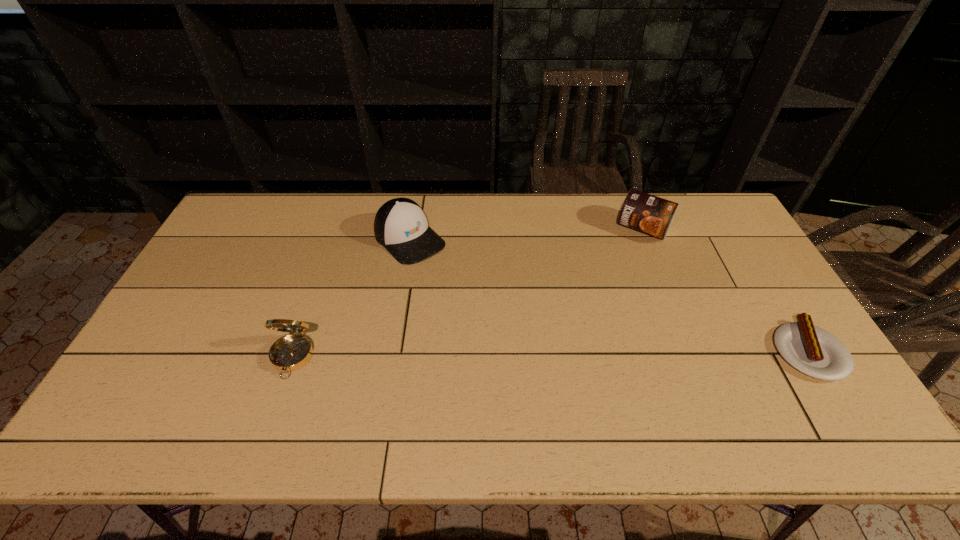
Locate an element on the screen. This screenshot has width=960, height=540. empty location between the can and the cap is located at coordinates (526, 234).

Locate an element on the screen. free space between the can and the cap is located at coordinates (526, 234).

I want to click on free space between the leftmost object and the rightmost object, so click(x=550, y=354).

Locate an element on the screen. This screenshot has width=960, height=540. vacant area between the compass and the shortest object is located at coordinates (550, 354).

Locate an element on the screen. object that is the second nearest to the can is located at coordinates (400, 226).

Locate which object is the second closest to the cap. Please provide its 2D coordinates. Your answer should be formatted as a tuple, i.e. [(x, y)], where the tuple contains the x and y coordinates of a point satisfying the conditions above.

[(647, 213)]